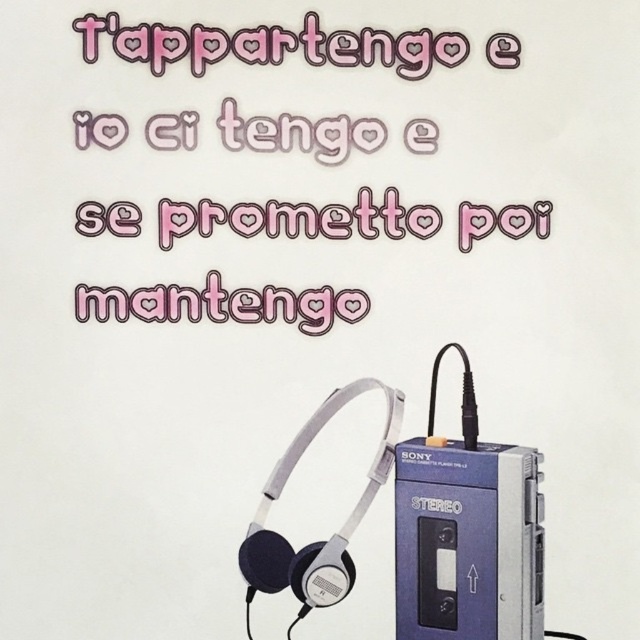
You are designing a poster and need to place the pink paper text at upper center and blue plastic cassette at lower right. According to the image, which object takes up more visual space?

The pink paper text at upper center takes up more visual space because it has a larger size compared to the blue plastic cassette at lower right.

You are designing a poster and need to place the pink paper text at upper center and the blue plastic cassette at lower right. Based on their sizes, which one should be placed higher up on the poster to maintain visual balance?

The pink paper text at upper center is much taller than the blue plastic cassette at lower right, so it should be placed higher up on the poster to maintain visual balance.